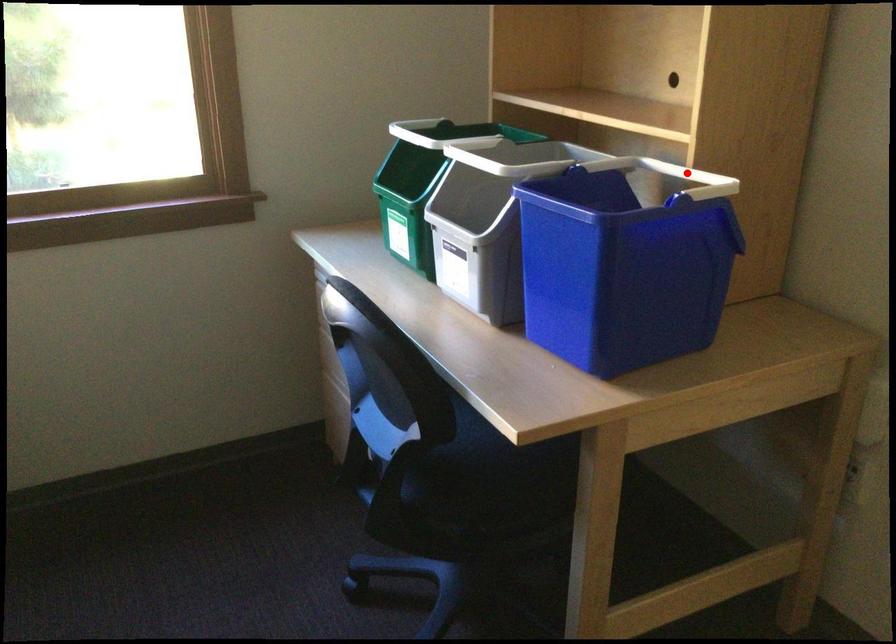
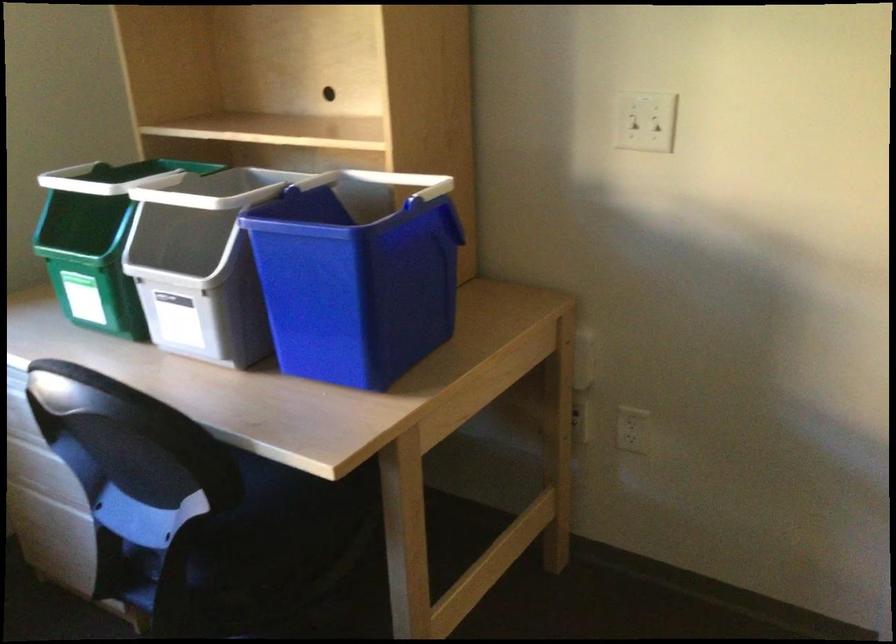
The point at the highlighted location is marked in the first image. Where is the corresponding point in the second image?

(399, 181)